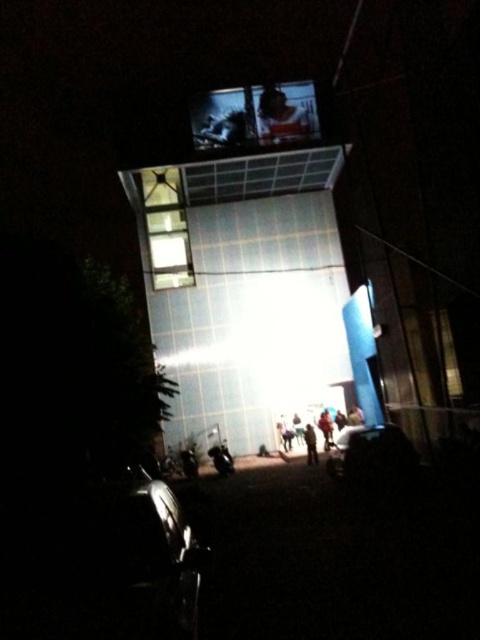
Question: Which point is farther to the camera?

Choices:
 (A) (307, 422)
 (B) (331, 429)

Answer: (A)

Question: Does blurred fabric person at center appear on the left side of light brown fabric pants at center?

Choices:
 (A) no
 (B) yes

Answer: (B)

Question: Which point is closer to the camera?

Choices:
 (A) blurred fabric person at center
 (B) light brown fabric pants at center

Answer: (A)

Question: Is blurred fabric person at center further to the viewer compared to light brown fabric pants at center?

Choices:
 (A) yes
 (B) no

Answer: (B)

Question: Which point is farther from the camera taking this photo?

Choices:
 (A) (x=314, y=454)
 (B) (x=330, y=433)

Answer: (B)

Question: Where is blurred fabric person at center located in relation to light brown fabric pants at center in the image?

Choices:
 (A) above
 (B) below

Answer: (A)